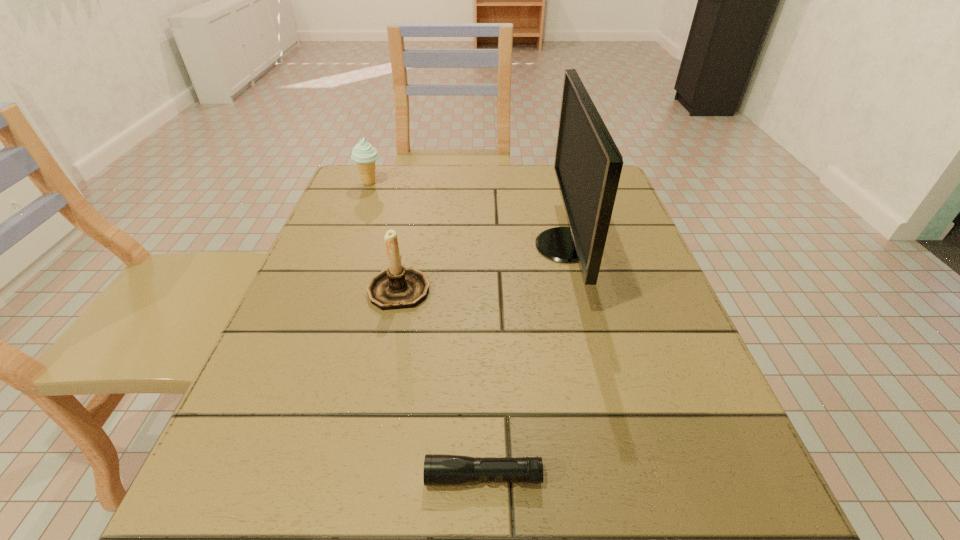
You are a GUI agent. You are given a task and a screenshot of the screen. Output one action in this format:
    pyautogui.click(x=<x>, y=<y>)
    Task: Click on the object that ranks as the closest to the computer monitor
    The width and height of the screenshot is (960, 540).
    Given the screenshot: What is the action you would take?
    pyautogui.click(x=397, y=287)

What are the coordinates of `the closest object to the rightmost object` in the screenshot? It's located at (397, 287).